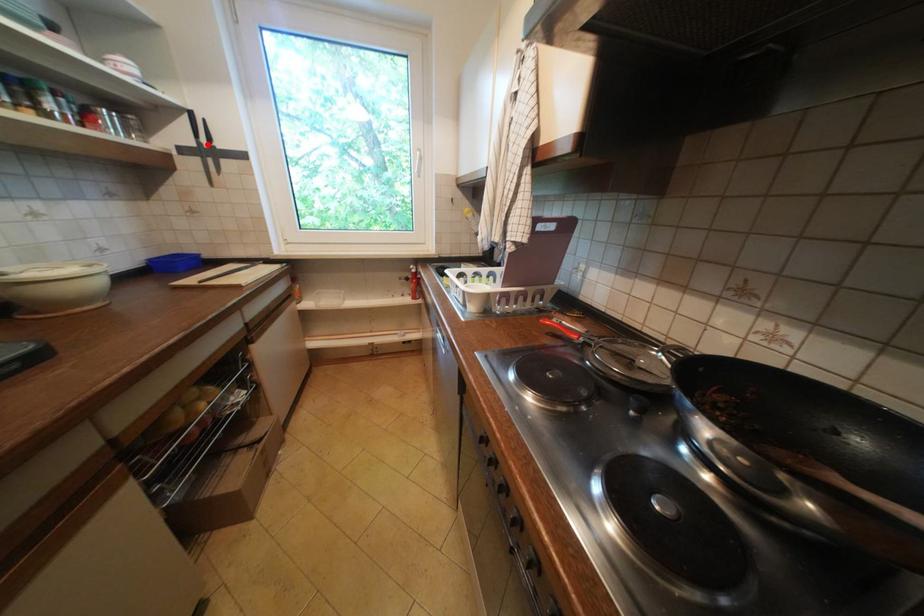
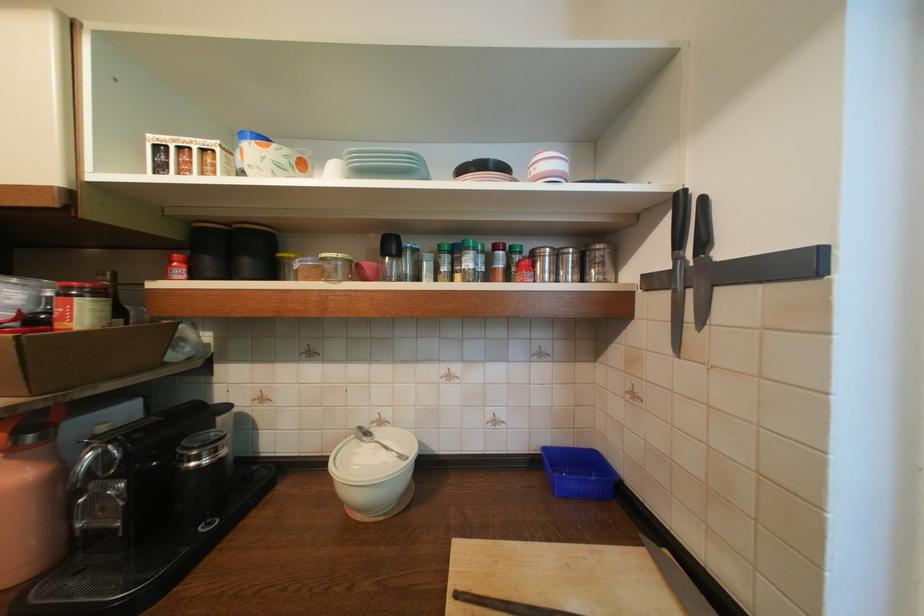
The point at the highlighted location is marked in the first image. Where is the corresponding point in the second image?

(686, 261)